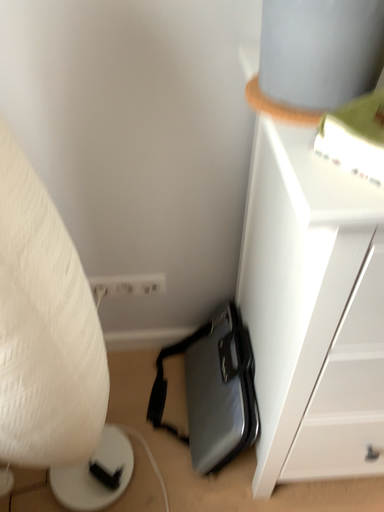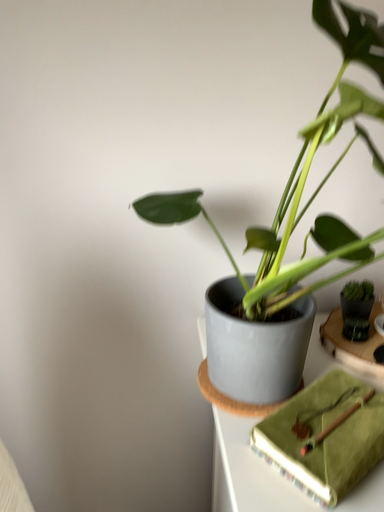
Question: How did the camera likely rotate when shooting the video?

Choices:
 (A) rotated downward
 (B) rotated upward

Answer: (B)